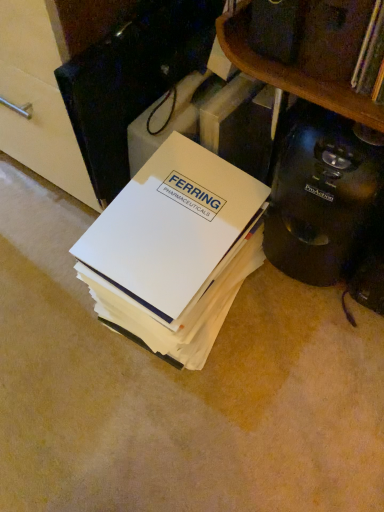
What do you see at coordinates (323, 195) in the screenshot? This screenshot has height=512, width=384. I see `black plastic coffee maker at lower right` at bounding box center [323, 195].

What is the approximate height of black plastic coffee maker at lower right?

black plastic coffee maker at lower right is 13.19 inches tall.

Identify the location of black plastic coffee maker at lower right. The width and height of the screenshot is (384, 512). (323, 195).

What is the approximate height of white paper at center?

white paper at center is 11.51 inches tall.

At what (x,y) coordinates should I click in order to perform the action: click on white paper at center. Please return your answer as a coordinate pair (x, y). Image resolution: width=384 pixels, height=512 pixels. Looking at the image, I should click on (175, 249).

What do you see at coordinates (175, 249) in the screenshot? The width and height of the screenshot is (384, 512). I see `white paper at center` at bounding box center [175, 249].

The height and width of the screenshot is (512, 384). In order to click on black plastic coffee maker at lower right in this screenshot , I will do `click(323, 195)`.

In the scene shown: Between white paper at center and black plastic coffee maker at lower right, which one appears on the right side from the viewer's perspective?

Positioned to the right is black plastic coffee maker at lower right.

Relative to black plastic coffee maker at lower right, is white paper at center in front or behind?

In the image, white paper at center appears behind black plastic coffee maker at lower right.

Is point (201, 172) positioned before point (276, 163)?

That is False.

From the image's perspective, is white paper at center below black plastic coffee maker at lower right?

Yes, from the image's perspective, white paper at center is below black plastic coffee maker at lower right.

From a real-world perspective, who is located higher, white paper at center or black plastic coffee maker at lower right?

From a 3D spatial view, black plastic coffee maker at lower right is above.

Considering the sizes of objects white paper at center and black plastic coffee maker at lower right in the image provided, who is thinner, white paper at center or black plastic coffee maker at lower right?

black plastic coffee maker at lower right is thinner.

Can you confirm if white paper at center is taller than black plastic coffee maker at lower right?

Incorrect, the height of white paper at center is not larger of that of black plastic coffee maker at lower right.

Who is smaller, white paper at center or black plastic coffee maker at lower right?

black plastic coffee maker at lower right.

Is white paper at center located outside black plastic coffee maker at lower right?

Yes, white paper at center is outside of black plastic coffee maker at lower right.

Is white paper at center in contact with black plastic coffee maker at lower right?

No, white paper at center is not beside black plastic coffee maker at lower right.

Is black plastic coffee maker at lower right at the back of white paper at center?

That's not correct — white paper at center is not looking away from black plastic coffee maker at lower right.

Identify the location of home appliance in front of the white paper at center. (323, 195).

Is black plastic coffee maker at lower right to the left of white paper at center from the viewer's perspective?

No.

Does black plastic coffee maker at lower right lie behind white paper at center?

No, black plastic coffee maker at lower right is closer to the camera.

Is point (301, 210) closer or farther from the camera than point (122, 239)?

Point (301, 210) appears to be farther away from the viewer than point (122, 239).

From the image's perspective, is black plastic coffee maker at lower right positioned above or below white paper at center?

black plastic coffee maker at lower right is situated higher than white paper at center in the image.

From a real-world perspective, is black plastic coffee maker at lower right below white paper at center?

No, from a real-world perspective, black plastic coffee maker at lower right is not below white paper at center.

Is black plastic coffee maker at lower right wider or thinner than white paper at center?

In the image, black plastic coffee maker at lower right appears to be more narrow than white paper at center.

Considering the relative sizes of black plastic coffee maker at lower right and white paper at center in the image provided, is black plastic coffee maker at lower right taller than white paper at center?

Yes, black plastic coffee maker at lower right is taller than white paper at center.

Considering the sizes of objects black plastic coffee maker at lower right and white paper at center in the image provided, who is bigger, black plastic coffee maker at lower right or white paper at center?

With larger size is white paper at center.

Is black plastic coffee maker at lower right completely or partially outside of white paper at center?

Yes, black plastic coffee maker at lower right is located beyond the bounds of white paper at center.

Can you see black plastic coffee maker at lower right touching white paper at center?

There is a gap between black plastic coffee maker at lower right and white paper at center.

Is black plastic coffee maker at lower right facing towards white paper at center?

No.

How different are the orientations of black plastic coffee maker at lower right and white paper at center in degrees?

The facing directions of black plastic coffee maker at lower right and white paper at center are 1.41 degrees apart.

The height and width of the screenshot is (512, 384). In the image, there is a white paper at center. Identify the location of home appliance above it (from the image's perspective). (323, 195).

In the image, there is a black plastic coffee maker at lower right. Where is `paperback book below it (from the image's perspective)`? The width and height of the screenshot is (384, 512). paperback book below it (from the image's perspective) is located at coordinates (175, 249).

What are the coordinates of `paperback book that is under the black plastic coffee maker at lower right (from a real-world perspective)` in the screenshot? It's located at (175, 249).